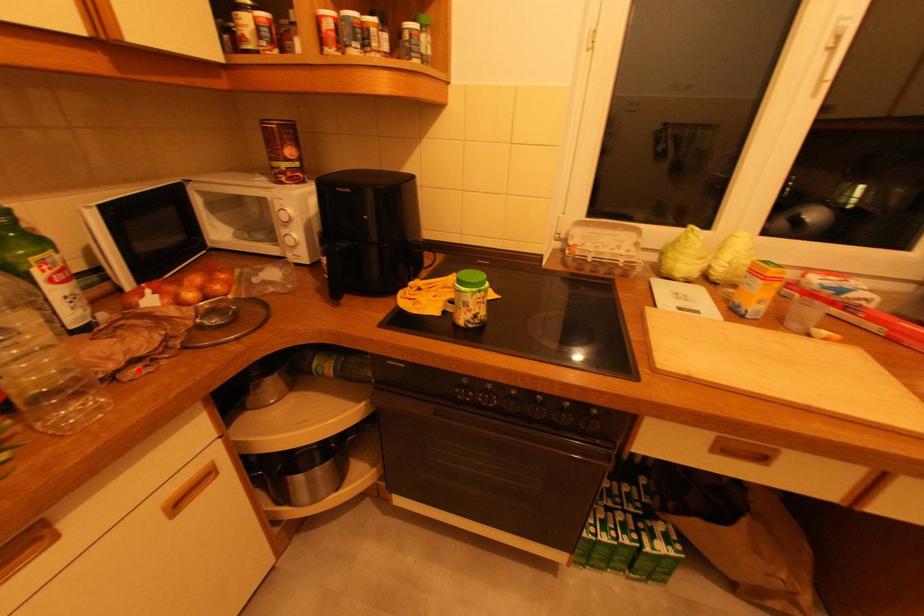
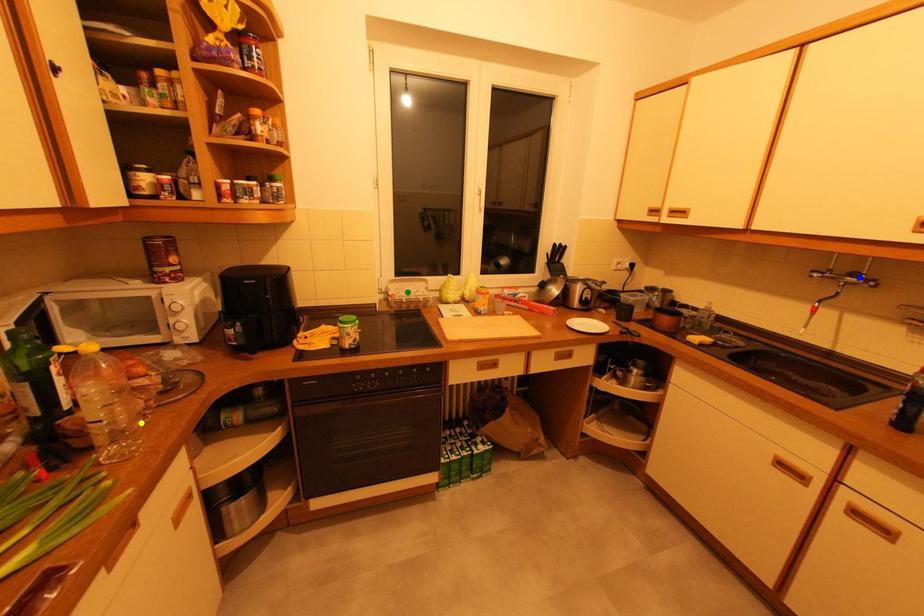
Question: I am providing you with two images of the same scene from different viewpoints. A red point is marked on the first image. You are given multiple points on the second image. Which point in image 2 represents the same 3d spot as the red point in image 1?

Choices:
 (A) blue point
 (B) yellow point
 (C) green point

Answer: (B)